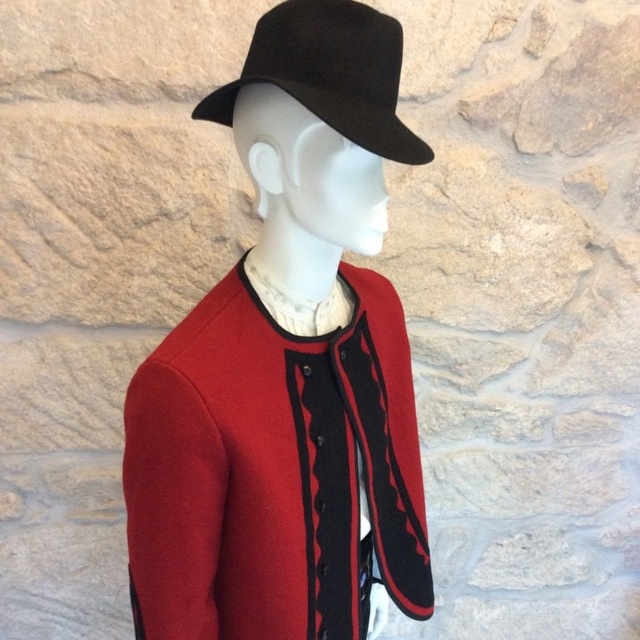
Which is above, matte black hat at center or black felt fedora at upper center?

black felt fedora at upper center is higher up.

Can you confirm if matte black hat at center is wider than black felt fedora at upper center?

Correct, the width of matte black hat at center exceeds that of black felt fedora at upper center.

What do you see at coordinates (289, 369) in the screenshot?
I see `matte black hat at center` at bounding box center [289, 369].

Locate an element on the screen. The width and height of the screenshot is (640, 640). matte black hat at center is located at coordinates (289, 369).